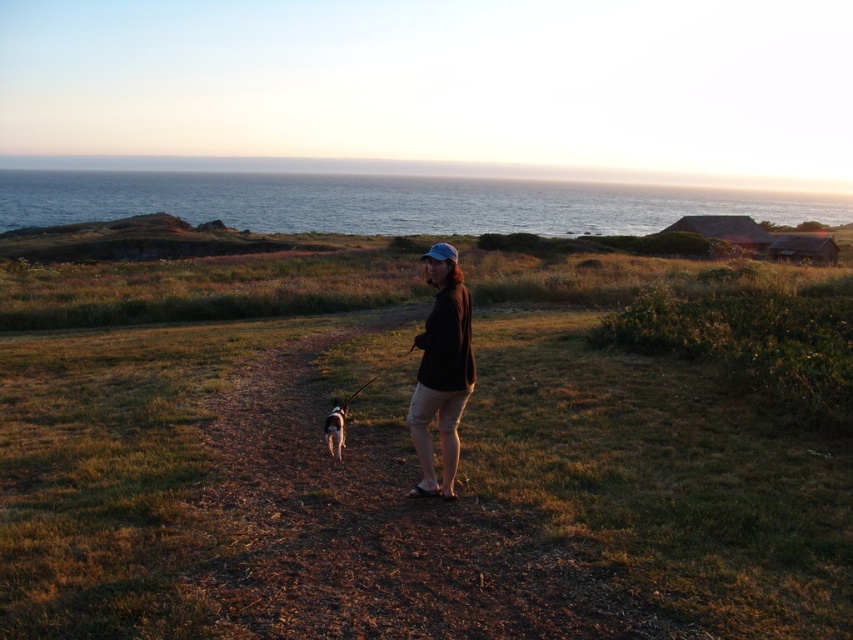
You are standing at the starting point of your walk and see the brown dirt path at center. Based on its position, can you determine if it leads towards the coast or away from it?

The brown dirt path at center is located at point (378,529), which places it in the central area of the scene. Since the scene depicts a grassy open area near the coast with the path winding through the foreground, the path likely leads towards the coast as it is positioned centrally and typically such paths in coastal areas are designed to guide towards the shoreline.

You are a photographer standing at the edge of the dirt path. You want to take a photo of the brown matte jacket at center and the white fur dog at center such that both are in focus. Given that your camera has a depth of field that can cover 5 feet, will both subjects be in focus?

The distance between the brown matte jacket at center and the white fur dog at center is 4.33 feet, which is less than the camera depth of field of 5 feet. Therefore, both subjects will be in focus.